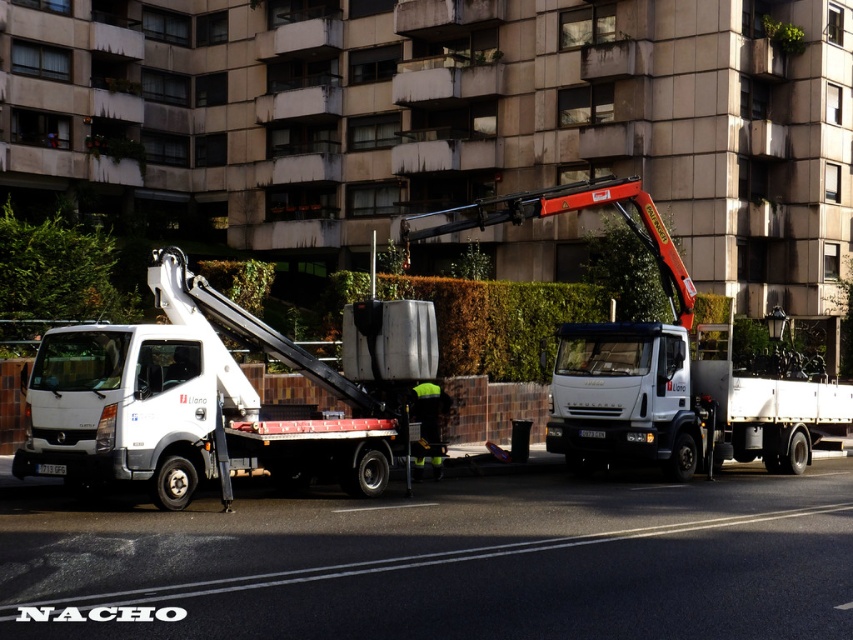
Can you confirm if white glossy tow truck at center is positioned to the left of white matte truck at center?

Indeed, white glossy tow truck at center is positioned on the left side of white matte truck at center.

Is point (570, 328) behind point (772, 381)?

No, it is not.

Is point (627, 388) farther from viewer compared to point (596, 390)?

No.

I want to click on white glossy tow truck at center, so click(x=656, y=364).

Who is positioned more to the left, white matte truck at left or white glossy tow truck at center?

Positioned to the left is white matte truck at left.

Measure the distance between white matte truck at left and camera.

11.99 meters

Identify the location of white matte truck at left. The image size is (853, 640). (187, 403).

The image size is (853, 640). What are the coordinates of `white matte truck at left` in the screenshot? It's located at (187, 403).

Can you confirm if white matte truck at left is positioned to the right of white matte truck at center?

No, white matte truck at left is not to the right of white matte truck at center.

Between white matte truck at left and white matte truck at center, which one has more height?

white matte truck at left is taller.

Is point (155, 477) positioned behind point (770, 449)?

No, (155, 477) is closer to viewer.

Find the location of a particular element. white matte truck at left is located at coordinates (x=187, y=403).